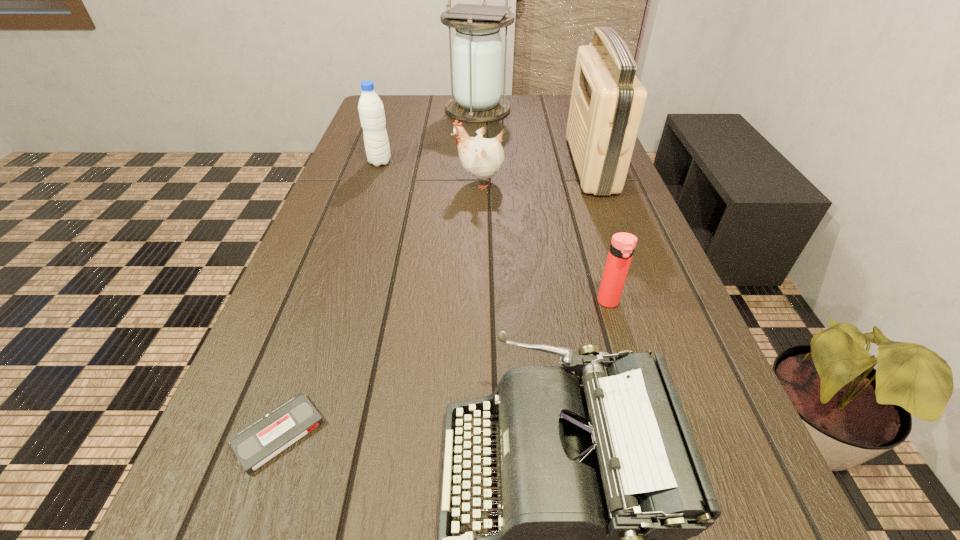
The height and width of the screenshot is (540, 960). I want to click on vacant space positioned 0.160m on the right of the water bottle, so click(x=448, y=162).

Locate an element on the screen. The height and width of the screenshot is (540, 960). blank area located at the beak of the bird is located at coordinates (419, 182).

Where is `free location located 0.150m at the beak of the bird`? free location located 0.150m at the beak of the bird is located at coordinates (396, 182).

Where is `blank space located 0.080m at the beak of the bird`? This screenshot has width=960, height=540. blank space located 0.080m at the beak of the bird is located at coordinates (422, 182).

What are the coordinates of `blank space located 0.200m on the front of the thermos bottle` in the screenshot? It's located at (638, 406).

At what (x,y) coordinates should I click in order to perform the action: click on free region located 0.290m on the right of the videotape. Please return your answer as a coordinate pair (x, y). The height and width of the screenshot is (540, 960). Looking at the image, I should click on (516, 433).

This screenshot has height=540, width=960. Identify the location of object positioned at the far edge. (477, 49).

I want to click on water bottle at the left edge, so click(x=371, y=110).

Locate an element on the screen. The width and height of the screenshot is (960, 540). videotape that is at the left edge is located at coordinates (255, 445).

At what (x,y) coordinates should I click in order to perform the action: click on radio receiver positioned at the right edge. Please return your answer as a coordinate pair (x, y). Image resolution: width=960 pixels, height=540 pixels. Looking at the image, I should click on click(607, 101).